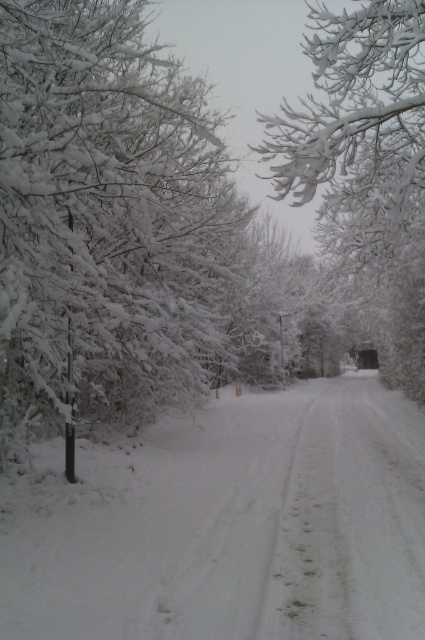
Question: Is white frosty tree at left wider than white frosty branches at upper center?

Choices:
 (A) yes
 (B) no

Answer: (B)

Question: Is white fluffy snow at center thinner than white frosty branches at upper center?

Choices:
 (A) yes
 (B) no

Answer: (B)

Question: Which object appears farthest from the camera in this image?

Choices:
 (A) white fluffy snow at center
 (B) white frosty branches at upper center
 (C) white frosty tree at left

Answer: (B)

Question: Which point is farther from the camera taking this photo?

Choices:
 (A) tap(390, 67)
 (B) tap(323, 392)

Answer: (B)

Question: Where is white frosty tree at left located in relation to white frosty branches at upper center in the image?

Choices:
 (A) left
 (B) right

Answer: (A)

Question: Which object appears closest to the camera in this image?

Choices:
 (A) white frosty branches at upper center
 (B) white frosty tree at left
 (C) white fluffy snow at center

Answer: (C)